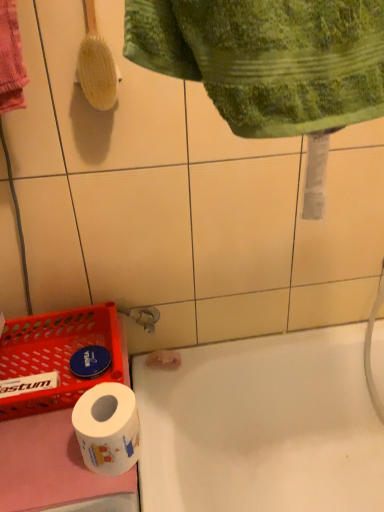
Question: Considering the relative sizes of white glossy toilet paper at lower left and yellow wooden brush at upper left in the image provided, is white glossy toilet paper at lower left thinner than yellow wooden brush at upper left?

Choices:
 (A) no
 (B) yes

Answer: (A)

Question: Is white glossy toilet paper at lower left to the right of yellow wooden brush at upper left from the viewer's perspective?

Choices:
 (A) yes
 (B) no

Answer: (A)

Question: From a real-world perspective, is white glossy toilet paper at lower left on yellow wooden brush at upper left?

Choices:
 (A) yes
 (B) no

Answer: (B)

Question: Considering the relative sizes of white glossy toilet paper at lower left and yellow wooden brush at upper left in the image provided, is white glossy toilet paper at lower left wider than yellow wooden brush at upper left?

Choices:
 (A) no
 (B) yes

Answer: (B)

Question: Is white glossy toilet paper at lower left placed right next to yellow wooden brush at upper left?

Choices:
 (A) no
 (B) yes

Answer: (A)

Question: From a real-world perspective, is white glossy toilet paper at lower left positioned under yellow wooden brush at upper left based on gravity?

Choices:
 (A) yes
 (B) no

Answer: (A)

Question: From the image's perspective, would you say white glossy bathtub at lower center is shown under yellow wooden brush at upper left?

Choices:
 (A) no
 (B) yes

Answer: (B)

Question: Are white glossy bathtub at lower center and yellow wooden brush at upper left beside each other?

Choices:
 (A) yes
 (B) no

Answer: (B)

Question: Is the depth of white glossy bathtub at lower center less than that of yellow wooden brush at upper left?

Choices:
 (A) no
 (B) yes

Answer: (A)

Question: From a real-world perspective, is white glossy bathtub at lower center on yellow wooden brush at upper left?

Choices:
 (A) no
 (B) yes

Answer: (A)

Question: From a real-world perspective, is white glossy bathtub at lower center under yellow wooden brush at upper left?

Choices:
 (A) no
 (B) yes

Answer: (B)

Question: Can you confirm if white glossy bathtub at lower center is wider than yellow wooden brush at upper left?

Choices:
 (A) no
 (B) yes

Answer: (B)

Question: Is yellow wooden brush at upper left outside of green textured towel at upper center?

Choices:
 (A) yes
 (B) no

Answer: (A)